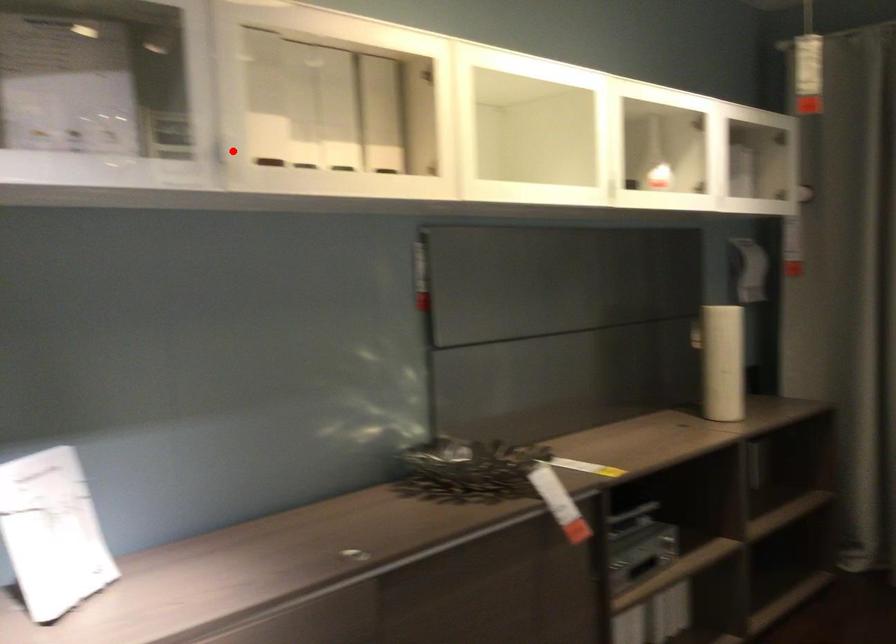
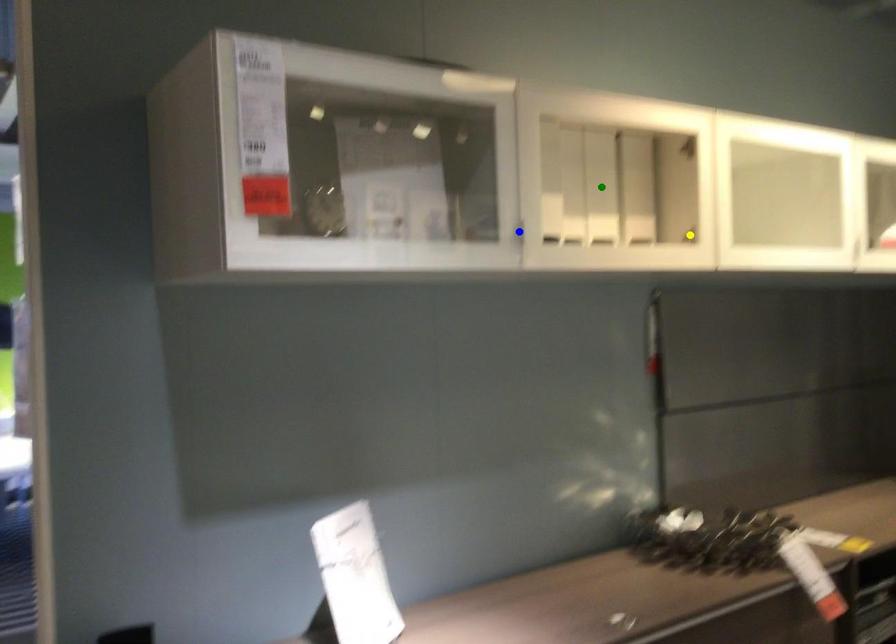
Question: I am providing you with two images of the same scene from different viewpoints. A red point is marked on the first image. You are given multiple points on the second image. In image 2, which mark is for the same physical point as the one in image 1?

Choices:
 (A) blue point
 (B) green point
 (C) yellow point

Answer: (A)